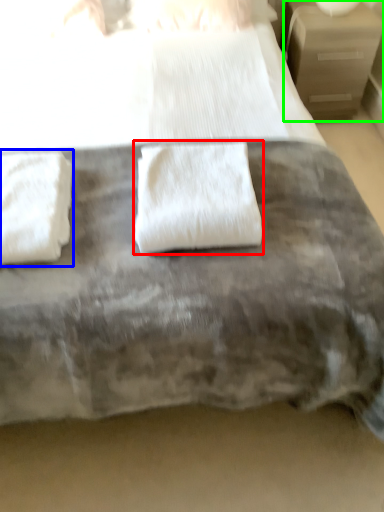
Question: Based on their relative distances, which object is nearer to towel (highlighted by a red box)? Choose from towel (highlighted by a blue box) and nightstand (highlighted by a green box).

Choices:
 (A) towel
 (B) nightstand

Answer: (A)